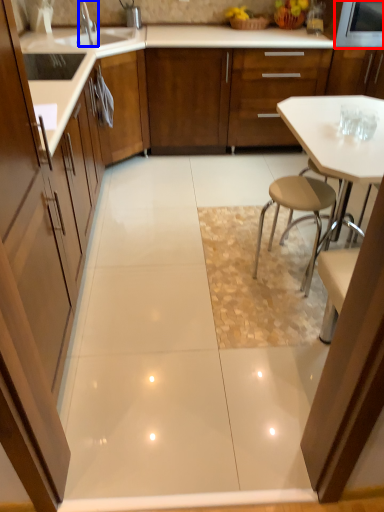
Question: Which object is closer to the camera taking this photo, appliance (highlighted by a red box) or tap (highlighted by a blue box)?

Choices:
 (A) appliance
 (B) tap

Answer: (B)